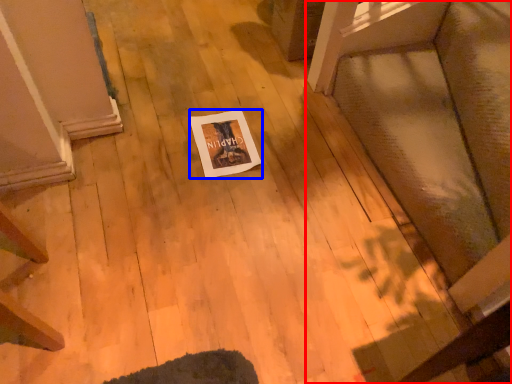
Question: Which point is closer to the camera, furniture (highlighted by a red box) or postcard (highlighted by a blue box)?

Choices:
 (A) furniture
 (B) postcard

Answer: (A)